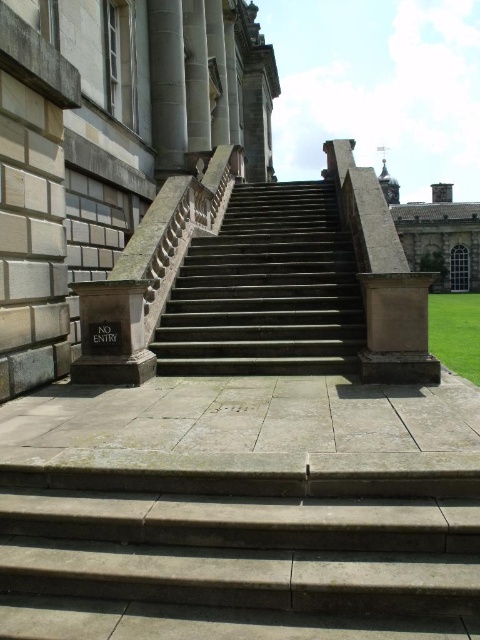
Does sandy stone pillar at center appear on the left side of slate gray stone column at upper left?

No, sandy stone pillar at center is not to the left of slate gray stone column at upper left.

Is sandy stone pillar at center shorter than slate gray stone column at upper left?

No.

Measure the distance between sandy stone pillar at center and camera.

sandy stone pillar at center is 18.89 feet from camera.

The width and height of the screenshot is (480, 640). In order to click on sandy stone pillar at center in this screenshot , I will do `click(383, 276)`.

Does gray stone stairs at lower center lie in front of slate gray stone column at upper left?

Yes, it is in front of slate gray stone column at upper left.

Does gray stone stairs at lower center appear over slate gray stone column at upper left?

No.

Between point (264, 570) and point (157, 45), which one is positioned behind?

Point (157, 45)

Where is `gray stone stairs at lower center`? gray stone stairs at lower center is located at coordinates pos(237,554).

Is dark gray stone stairs at center to the left of slate gray stone column at upper left from the viewer's perspective?

In fact, dark gray stone stairs at center is to the right of slate gray stone column at upper left.

Is dark gray stone stairs at center to the right of slate gray stone column at upper left from the viewer's perspective?

Indeed, dark gray stone stairs at center is positioned on the right side of slate gray stone column at upper left.

Where is `dark gray stone stairs at center`? The width and height of the screenshot is (480, 640). dark gray stone stairs at center is located at coordinates (265, 289).